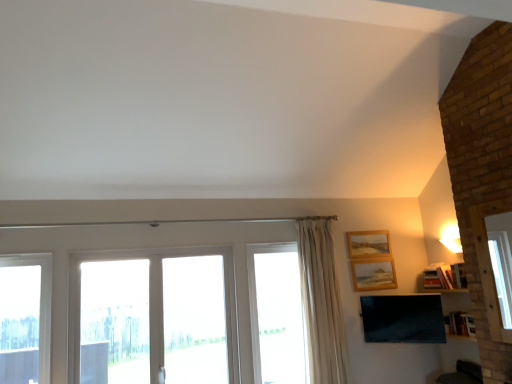
Question: Should I look upward or downward to see transparent glass door at center, arranged as the second window when viewed from the left?

Choices:
 (A) up
 (B) down

Answer: (B)

Question: From the image's perspective, is clear glass window at left, arranged as the 1th window when viewed from the left, under clear glass window at center, arranged as the 1th window when viewed from the right?

Choices:
 (A) no
 (B) yes

Answer: (A)

Question: Can you confirm if clear glass window at left, which appears as the 3th window when viewed from the right, is smaller than clear glass window at center, arranged as the third window when viewed from the left?

Choices:
 (A) yes
 (B) no

Answer: (A)

Question: Does clear glass window at left, arranged as the 1th window when viewed from the left, have a larger size compared to clear glass window at center, arranged as the third window when viewed from the left?

Choices:
 (A) yes
 (B) no

Answer: (B)

Question: Considering the relative sizes of clear glass window at left, arranged as the 1th window when viewed from the left, and clear glass window at center, arranged as the 1th window when viewed from the right, in the image provided, is clear glass window at left, arranged as the 1th window when viewed from the left, shorter than clear glass window at center, arranged as the 1th window when viewed from the right,?

Choices:
 (A) no
 (B) yes

Answer: (B)

Question: Is clear glass window at left, which appears as the 3th window when viewed from the right, with clear glass window at center, arranged as the 1th window when viewed from the right?

Choices:
 (A) no
 (B) yes

Answer: (A)

Question: Would you consider clear glass window at left, arranged as the 1th window when viewed from the left, to be distant from clear glass window at center, arranged as the 1th window when viewed from the right?

Choices:
 (A) yes
 (B) no

Answer: (A)

Question: Could wooden picture frame at upper right, positioned as the second picture frame in top-to-bottom order, be considered to be inside wooden picture frame at upper right, marked as the first picture frame in a top-to-bottom arrangement?

Choices:
 (A) yes
 (B) no

Answer: (B)

Question: Does wooden picture frame at upper right, which appears as the second picture frame when ordered from the bottom, have a larger size compared to wooden picture frame at upper right, marked as the 1th picture frame in a bottom-to-top arrangement?

Choices:
 (A) no
 (B) yes

Answer: (B)

Question: Can you confirm if wooden picture frame at upper right, which appears as the second picture frame when ordered from the bottom, is taller than wooden picture frame at upper right, positioned as the second picture frame in top-to-bottom order?

Choices:
 (A) no
 (B) yes

Answer: (A)

Question: Does wooden picture frame at upper right, which appears as the second picture frame when ordered from the bottom, come behind wooden picture frame at upper right, positioned as the second picture frame in top-to-bottom order?

Choices:
 (A) no
 (B) yes

Answer: (B)

Question: From a real-world perspective, is wooden picture frame at upper right, which appears as the second picture frame when ordered from the bottom, positioned under wooden picture frame at upper right, positioned as the second picture frame in top-to-bottom order, based on gravity?

Choices:
 (A) yes
 (B) no

Answer: (B)

Question: Considering the relative sizes of wooden picture frame at upper right, marked as the first picture frame in a top-to-bottom arrangement, and wooden picture frame at upper right, marked as the 1th picture frame in a bottom-to-top arrangement, in the image provided, is wooden picture frame at upper right, marked as the first picture frame in a top-to-bottom arrangement, smaller than wooden picture frame at upper right, marked as the 1th picture frame in a bottom-to-top arrangement,?

Choices:
 (A) no
 (B) yes

Answer: (A)

Question: Is clear glass window at left, arranged as the 1th window when viewed from the left, wider than wooden picture frame at upper right, which appears as the second picture frame when ordered from the bottom?

Choices:
 (A) no
 (B) yes

Answer: (B)